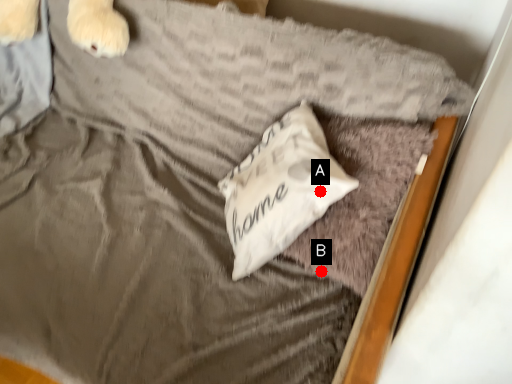
Question: Two points are circled on the image, labeled by A and B beside each circle. Which of the following is the farthest from the observer?

Choices:
 (A) A is further
 (B) B is further

Answer: (B)